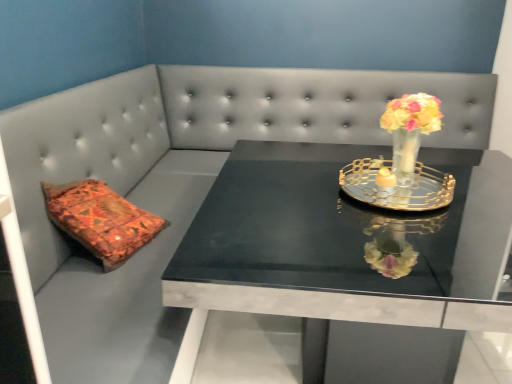
Question: Does gold metallic tray at center have a greater height compared to translucent glass vase at upper right?

Choices:
 (A) yes
 (B) no

Answer: (B)

Question: Is the surface of gold metallic tray at center in direct contact with translucent glass vase at upper right?

Choices:
 (A) no
 (B) yes

Answer: (A)

Question: Is translucent glass vase at upper right inside gold metallic tray at center?

Choices:
 (A) no
 (B) yes

Answer: (A)

Question: Can you confirm if gold metallic tray at center is wider than translucent glass vase at upper right?

Choices:
 (A) yes
 (B) no

Answer: (A)

Question: Is gold metallic tray at center oriented away from translucent glass vase at upper right?

Choices:
 (A) yes
 (B) no

Answer: (A)

Question: Is black marble table at center bigger or smaller than translucent glass vase at upper right?

Choices:
 (A) big
 (B) small

Answer: (A)

Question: From their relative heights in the image, would you say black marble table at center is taller or shorter than translucent glass vase at upper right?

Choices:
 (A) short
 (B) tall

Answer: (B)

Question: From the image's perspective, is black marble table at center positioned above or below translucent glass vase at upper right?

Choices:
 (A) below
 (B) above

Answer: (A)

Question: Looking at their shapes, would you say black marble table at center is wider or thinner than translucent glass vase at upper right?

Choices:
 (A) wide
 (B) thin

Answer: (A)

Question: Considering their positions, is gold metallic tray at center located in front of or behind translucent glass vase at upper right?

Choices:
 (A) front
 (B) behind

Answer: (A)

Question: From the image's perspective, is gold metallic tray at center positioned above or below translucent glass vase at upper right?

Choices:
 (A) below
 (B) above

Answer: (A)

Question: Is gold metallic tray at center situated inside translucent glass vase at upper right or outside?

Choices:
 (A) inside
 (B) outside

Answer: (B)

Question: Does point (444, 188) appear closer or farther from the camera than point (413, 125)?

Choices:
 (A) closer
 (B) farther

Answer: (B)

Question: Is translucent glass vase at upper right wider or thinner than gold metallic tray at center?

Choices:
 (A) thin
 (B) wide

Answer: (A)

Question: From the image's perspective, relative to gold metallic tray at center, is translucent glass vase at upper right above or below?

Choices:
 (A) below
 (B) above

Answer: (B)